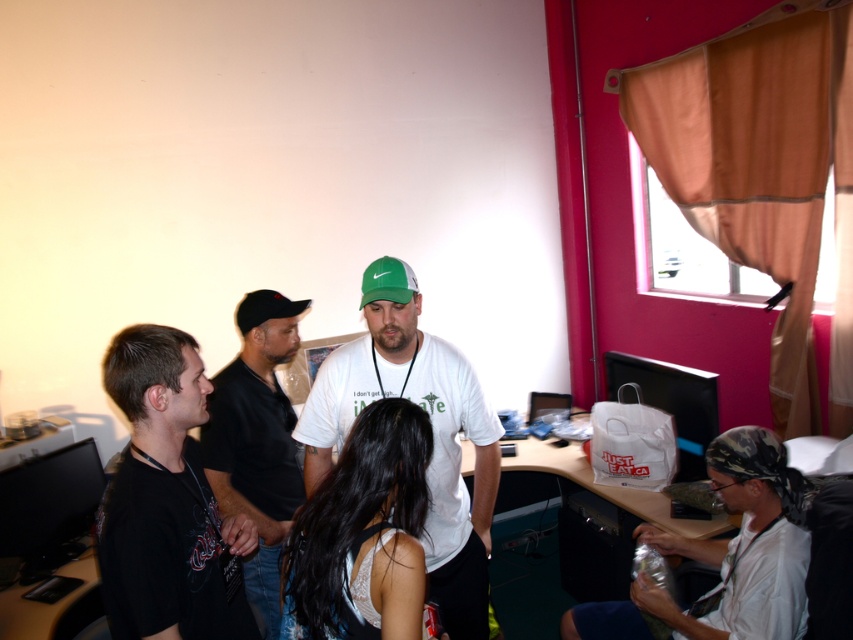
Question: Is white matte t-shirt at center above black matte shirt at center?

Choices:
 (A) yes
 (B) no

Answer: (B)

Question: Is black glossy monitor at lower left bigger than wooden desk at lower left?

Choices:
 (A) no
 (B) yes

Answer: (A)

Question: Estimate the real-world distances between objects in this image. Which object is closer to the camouflage bandana at lower right?

Choices:
 (A) black glossy monitor at lower left
 (B) black matte t-shirt at left
 (C) white matte t-shirt at center

Answer: (C)

Question: Which object is positioned farthest from the black glossy monitor at right?

Choices:
 (A) green matte baseball cap at center
 (B) black glossy monitor at lower left
 (C) white matte t-shirt at center

Answer: (B)

Question: Estimate the real-world distances between objects in this image. Which object is closer to the black glossy monitor at lower left?

Choices:
 (A) green matte baseball cap at center
 (B) wooden desk at lower left
 (C) camouflage bandana at lower right
 (D) black glossy monitor at right

Answer: (B)

Question: Is white matte t-shirt at center wider than green matte baseball cap at center?

Choices:
 (A) no
 (B) yes

Answer: (B)